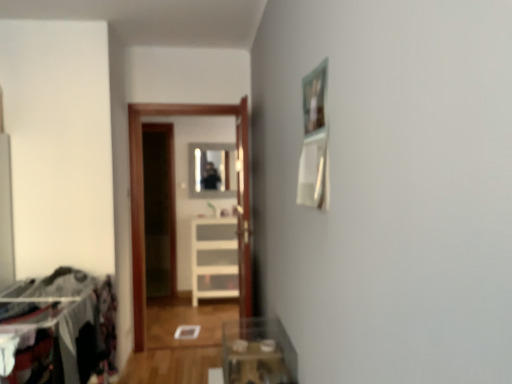
Locate an element on the screen. The width and height of the screenshot is (512, 384). dark fabric laundry at left is located at coordinates (56, 326).

Measure the distance between point (x=136, y=296) and camera.

The depth of point (x=136, y=296) is 3.75 meters.

I want to click on clear glass table at lower center, so click(x=258, y=352).

Looking at this image, can you confirm if white plastic drawer at center is positioned to the right of transparent glass door at center?

Indeed, white plastic drawer at center is positioned on the right side of transparent glass door at center.

Looking at the image, does white plastic drawer at center seem bigger or smaller compared to transparent glass door at center?

Considering their sizes, white plastic drawer at center takes up more space than transparent glass door at center.

Locate an element on the screen. glass door in front of the white plastic drawer at center is located at coordinates (143, 199).

What's the angular difference between white plastic drawer at center and transparent glass door at center's facing directions?

white plastic drawer at center and transparent glass door at center are facing 2.16 degrees away from each other.

Considering the positions of objects dark fabric laundry at left and transparent glass door at center in the image provided, who is more to the right, dark fabric laundry at left or transparent glass door at center?

transparent glass door at center is more to the right.

Considering the points (21, 311) and (248, 293), which point is behind, point (21, 311) or point (248, 293)?

Point (248, 293)

From a real-world perspective, which object rests below the other?

dark fabric laundry at left.

Which object is closer to the camera taking this photo, dark fabric laundry at left or transparent glass door at center?

dark fabric laundry at left is closer to the camera.

How many degrees apart are the facing directions of white plastic drawer at center and clear glass mirror at center?

2.1 degrees.

Does white plastic drawer at center have a larger size compared to clear glass mirror at center?

Yes.

Which is more to the left, white plastic drawer at center or clear glass mirror at center?

Positioned to the left is clear glass mirror at center.

From the image's perspective, is white plastic drawer at center located above or below clear glass mirror at center?

From the image's perspective, white plastic drawer at center appears below clear glass mirror at center.

Can we say transparent glass door at center lies outside clear glass mirror at center?

That's correct, transparent glass door at center is outside of clear glass mirror at center.

Is transparent glass door at center behind clear glass mirror at center?

No, transparent glass door at center is in front of clear glass mirror at center.

Is transparent glass door at center far away from clear glass mirror at center?

Yes, transparent glass door at center and clear glass mirror at center are located far from each other.

You are a GUI agent. You are given a task and a screenshot of the screen. Output one action in this format:
    pyautogui.click(x=<x>, y=<y>)
    Task: Click on the glass door that appears on the left of clear glass mirror at center
    The width and height of the screenshot is (512, 384).
    Given the screenshot: What is the action you would take?
    pyautogui.click(x=143, y=199)

Is dark fabric laundry at left oriented towards clear glass table at lower center?

Yes, dark fabric laundry at left is aimed at clear glass table at lower center.

Considering the relative positions of dark fabric laundry at left and clear glass table at lower center in the image provided, is dark fabric laundry at left to the left of clear glass table at lower center from the viewer's perspective?

Yes.

Which is in front, dark fabric laundry at left or clear glass table at lower center?

clear glass table at lower center.

Which of these two, dark fabric laundry at left or clear glass table at lower center, stands shorter?

clear glass table at lower center.

Is white plastic drawer at center directly adjacent to clear glass table at lower center?

They are not placed beside each other.

Between white plastic drawer at center and clear glass table at lower center, which one has smaller width?

With smaller width is clear glass table at lower center.

Based on the photo, from their relative heights in the image, would you say white plastic drawer at center is taller or shorter than clear glass table at lower center?

Considering their sizes, white plastic drawer at center has more height than clear glass table at lower center.

From the image's perspective, who appears lower, clear glass table at lower center or dark fabric laundry at left?

From the image's view, dark fabric laundry at left is below.

Is clear glass table at lower center further to camera compared to dark fabric laundry at left?

That is False.

Can you confirm if clear glass table at lower center is positioned to the right of dark fabric laundry at left?

Yes, clear glass table at lower center is to the right of dark fabric laundry at left.

Is clear glass table at lower center smaller than dark fabric laundry at left?

Yes.

Locate an element on the screen. Image resolution: width=512 pixels, height=384 pixels. furniture that appears behind the transparent glass door at center is located at coordinates (214, 259).

At what (x,y) coordinates should I click in order to perform the action: click on glass door that appears above the dark fabric laundry at left (from the image's perspective). Please return your answer as a coordinate pair (x, y). Looking at the image, I should click on (143, 199).

Based on the photo, estimate the real-world distances between objects in this image. Which object is closer to clear glass table at lower center, transparent glass door at center or clear glass mirror at center?

transparent glass door at center lies closer to clear glass table at lower center than the other object.

Based on the photo, which object lies further to the anchor point clear glass mirror at center, white plastic drawer at center or transparent glass door at center?

transparent glass door at center.

Which object lies further to the anchor point transparent glass door at center, dark fabric laundry at left or clear glass mirror at center?

The object further to transparent glass door at center is clear glass mirror at center.

Which object lies nearer to the anchor point dark fabric laundry at left, transparent glass door at center or clear glass mirror at center?

transparent glass door at center is positioned closer to the anchor dark fabric laundry at left.

Looking at this image, looking at the image, which one is located closer to clear glass table at lower center, dark fabric laundry at left or transparent glass door at center?

dark fabric laundry at left lies closer to clear glass table at lower center than the other object.

From the image, which object appears to be nearer to white plastic drawer at center, transparent glass door at center or clear glass mirror at center?

Based on the image, clear glass mirror at center appears to be nearer to white plastic drawer at center.

Which object lies further to the anchor point clear glass table at lower center, dark fabric laundry at left or clear glass mirror at center?

Among the two, clear glass mirror at center is located further to clear glass table at lower center.

From the image, which object appears to be farther from clear glass table at lower center, clear glass mirror at center or transparent glass door at center?

Among the two, clear glass mirror at center is located further to clear glass table at lower center.

Where is `furniture between transparent glass door at center and clear glass mirror at center in the front-back direction`? The height and width of the screenshot is (384, 512). furniture between transparent glass door at center and clear glass mirror at center in the front-back direction is located at coordinates (214, 259).

Identify the location of glass door located between dark fabric laundry at left and white plastic drawer at center in the depth direction. (143, 199).

Find the location of a particular element. furniture between dark fabric laundry at left and clear glass mirror at center along the z-axis is located at coordinates (214, 259).

At what (x,y) coordinates should I click in order to perform the action: click on laundry between clear glass table at lower center and transparent glass door at center in the front-back direction. Please return your answer as a coordinate pair (x, y). Looking at the image, I should click on (56, 326).